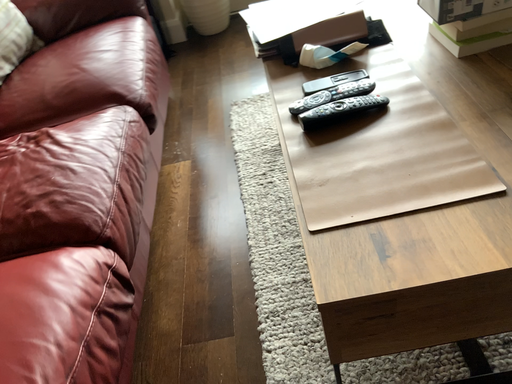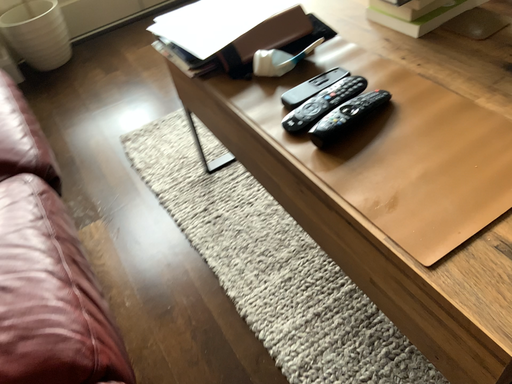
Question: How did the camera likely rotate when shooting the video?

Choices:
 (A) rotated left
 (B) rotated right

Answer: (B)